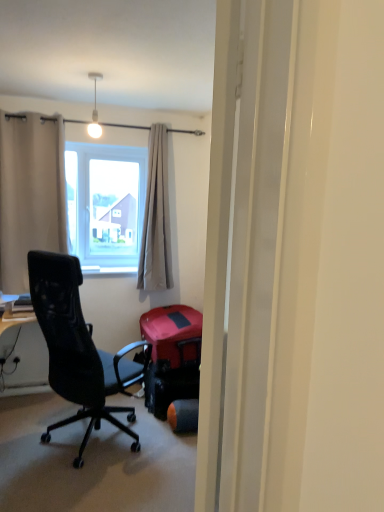
Question: Would you say light beige fabric curtain at center, which appears as the 1th curtain when viewed from the right, is to the left or to the right of beige fabric curtain at left, arranged as the 1th curtain when viewed from the left, in the picture?

Choices:
 (A) right
 (B) left

Answer: (A)

Question: From a real-world perspective, is light beige fabric curtain at center, the second curtain positioned from the left, above or below beige fabric curtain at left, placed as the second curtain when sorted from right to left?

Choices:
 (A) above
 (B) below

Answer: (B)

Question: Which of these objects is positioned closest to the beige fabric curtain at left, placed as the second curtain when sorted from right to left?

Choices:
 (A) transparent glass window at center
 (B) light beige fabric curtain at center, the second curtain positioned from the left
 (C) white glossy light bulb at upper center
 (D) transparent plastic screen door at center
 (E) rubberized red suitcase at center

Answer: (A)

Question: Which is farther from the white glossy light bulb at upper center?

Choices:
 (A) transparent plastic screen door at center
 (B) rubberized red suitcase at center
 (C) transparent glass window at center
 (D) light beige fabric curtain at center, which appears as the 1th curtain when viewed from the right
 (E) beige fabric curtain at left, placed as the second curtain when sorted from right to left

Answer: (A)